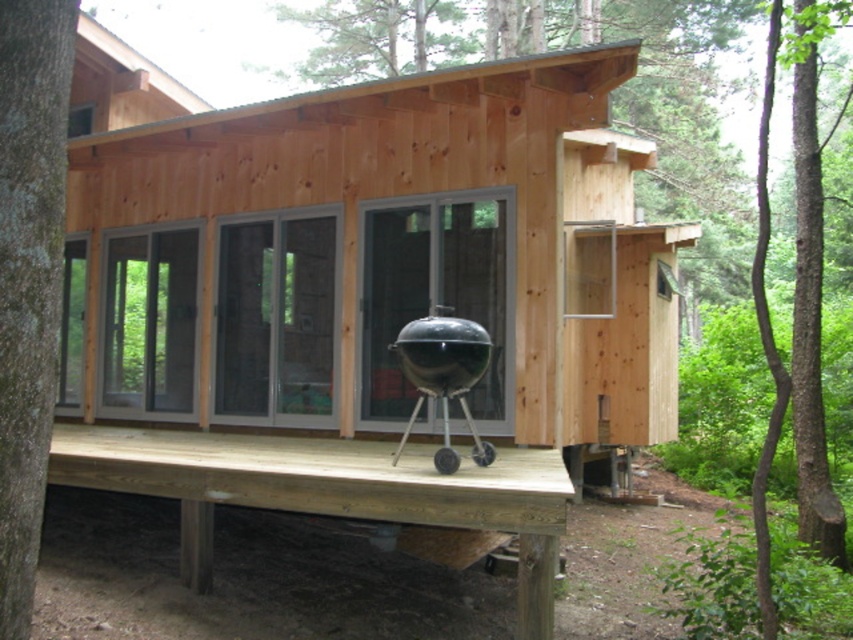
You are standing in front of the wooden cabin and want to walk from the natural wood deck at center to the green leafy tree at center. Which direction should you move in to get from the deck to the tree?

The natural wood deck at center has a lesser width compared to green leafy tree at center, so you should move towards the wider area to reach the green leafy tree at center.

You are standing in front of the wooden cabin and see the brown rough bark tree at left and the black matte barbecue grill at center. Which object is closer to your left side?

The brown rough bark tree at left is closer to your left side since it is positioned on the left side of the black matte barbecue grill at center.